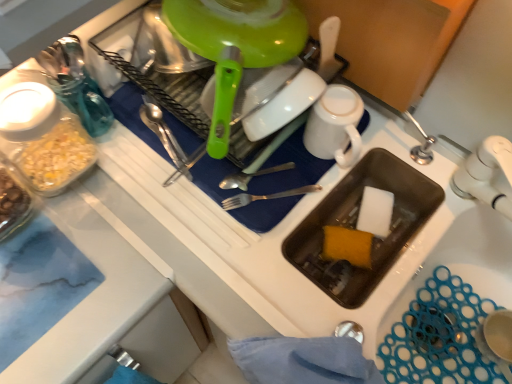
Question: Is shiny metal spoon at center inside white sponge at sink bottom, the 2th food viewed from the left?

Choices:
 (A) no
 (B) yes

Answer: (A)

Question: Could you tell me if white sponge at sink bottom, the 2th food viewed from the left, is facing shiny metal spoon at center?

Choices:
 (A) no
 (B) yes

Answer: (A)

Question: Does white sponge at sink bottom, the 2th food viewed from the left, come behind shiny metal spoon at center?

Choices:
 (A) no
 (B) yes

Answer: (B)

Question: Does white sponge at sink bottom, the 2th food viewed from the left, have a smaller size compared to shiny metal spoon at center?

Choices:
 (A) yes
 (B) no

Answer: (B)

Question: Considering the relative sizes of white sponge at sink bottom, the 2th food viewed from the left, and shiny metal spoon at center in the image provided, is white sponge at sink bottom, the 2th food viewed from the left, thinner than shiny metal spoon at center?

Choices:
 (A) yes
 (B) no

Answer: (A)

Question: From the image's perspective, is white sponge at sink bottom, the 2th food viewed from the left, on shiny metal spoon at center?

Choices:
 (A) yes
 (B) no

Answer: (B)

Question: Does white matte mug at upper center contain silver metallic fork at center?

Choices:
 (A) no
 (B) yes

Answer: (A)

Question: Is white matte mug at upper center touching silver metallic fork at center?

Choices:
 (A) no
 (B) yes

Answer: (A)

Question: From a real-world perspective, is white matte mug at upper center positioned over silver metallic fork at center based on gravity?

Choices:
 (A) no
 (B) yes

Answer: (B)

Question: Does white matte mug at upper center turn towards silver metallic fork at center?

Choices:
 (A) no
 (B) yes

Answer: (B)

Question: Is white matte mug at upper center facing away from silver metallic fork at center?

Choices:
 (A) no
 (B) yes

Answer: (A)

Question: Is white matte mug at upper center completely or partially outside of silver metallic fork at center?

Choices:
 (A) no
 (B) yes

Answer: (B)

Question: Considering the relative sizes of silver metallic fork at center and shiny metal spoon at center in the image provided, is silver metallic fork at center thinner than shiny metal spoon at center?

Choices:
 (A) no
 (B) yes

Answer: (A)